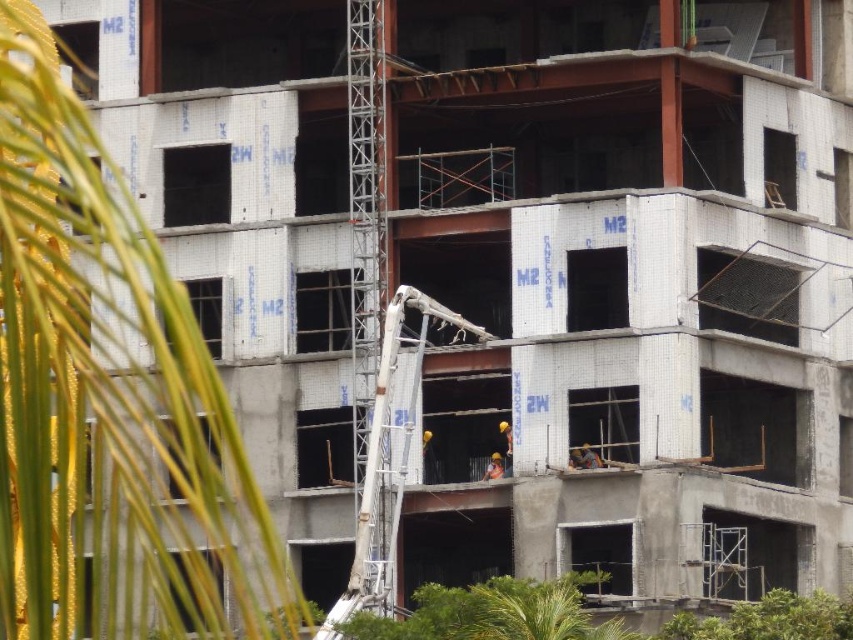
Measure the distance between green leafy palm tree at lower right and camera.

A distance of 66.49 meters exists between green leafy palm tree at lower right and camera.

Is green leafy palm tree at lower right positioned behind orange hard hat at center?

No.

Does point (479, 588) come behind point (599, 461)?

No, (479, 588) is closer to viewer.

Identify the location of green leafy palm tree at lower right. The image size is (853, 640). (532, 611).

Is white concrete ladder at center positioned behind green leafy palm tree at lower right?

Yes, white concrete ladder at center is behind green leafy palm tree at lower right.

Based on the photo, is white concrete ladder at center below green leafy palm tree at lower right?

Incorrect, white concrete ladder at center is not positioned below green leafy palm tree at lower right.

What are the coordinates of `white concrete ladder at center` in the screenshot? It's located at (389, 456).

Is green leafy palm tree at left smaller than hard hat construction worker at center?

Actually, green leafy palm tree at left might be larger than hard hat construction worker at center.

Locate an element on the screen. green leafy palm tree at left is located at coordinates (109, 401).

In order to click on green leafy palm tree at left in this screenshot , I will do (x=109, y=401).